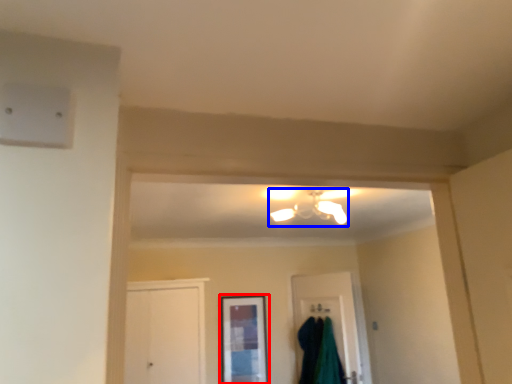
Question: Which object appears farthest to the camera in this image, window (highlighted by a red box) or light fixture (highlighted by a blue box)?

Choices:
 (A) window
 (B) light fixture

Answer: (A)